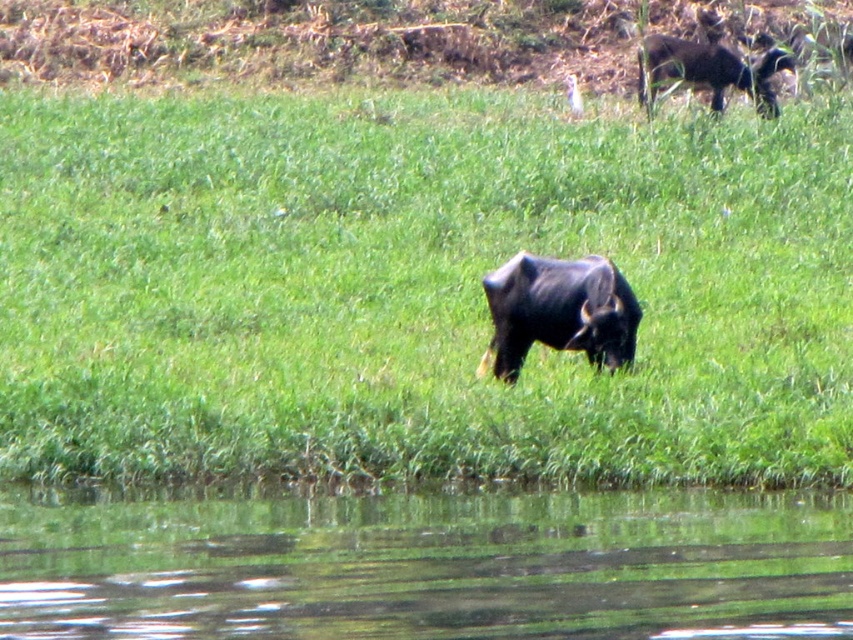
Does green grass at center have a greater height compared to green grassy river at lower center?

Yes.

Who is positioned more to the left, green grass at center or green grassy river at lower center?

Positioned to the left is green grassy river at lower center.

The image size is (853, 640). I want to click on green grass at center, so click(415, 289).

Is green grass at center above black glossy yak at center?

Indeed, green grass at center is positioned over black glossy yak at center.

Which is more to the left, green grass at center or black glossy yak at center?

green grass at center is more to the left.

Measure the distance between point (583, 461) and camera.

A distance of 37.94 feet exists between point (583, 461) and camera.

Where is `green grass at center`? Image resolution: width=853 pixels, height=640 pixels. green grass at center is located at coordinates (415, 289).

Describe the element at coordinates (428, 564) in the screenshot. I see `green grassy river at lower center` at that location.

Can you confirm if green grassy river at lower center is positioned above black glossy yak at center?

Incorrect, green grassy river at lower center is not positioned above black glossy yak at center.

Which is behind, point (351, 620) or point (619, 298)?

The point (619, 298) is more distant.

You are a GUI agent. You are given a task and a screenshot of the screen. Output one action in this format:
    pyautogui.click(x=<x>, y=<y>)
    Task: Click on the green grassy river at lower center
    This screenshot has height=640, width=853.
    Given the screenshot: What is the action you would take?
    pyautogui.click(x=428, y=564)